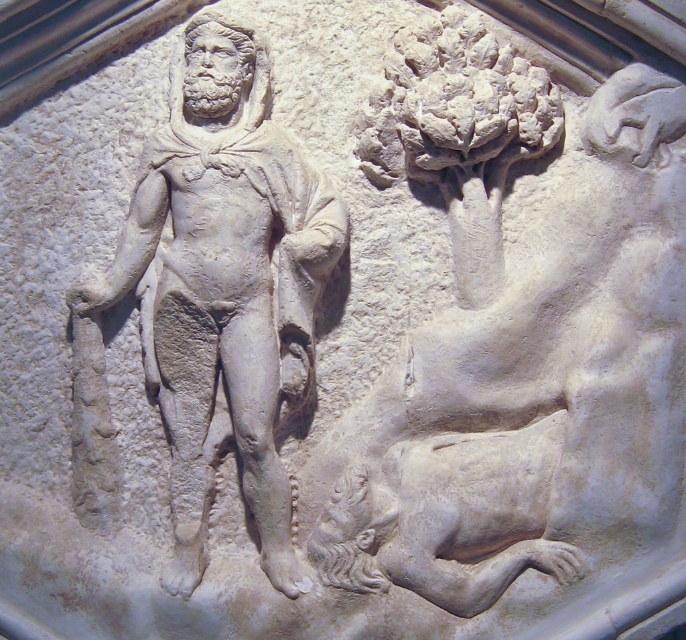
Question: Which of the following is the closest to the observer?

Choices:
 (A) click(x=99, y=467)
 (B) click(x=541, y=460)

Answer: (B)

Question: Which of the following is the farthest from the observer?

Choices:
 (A) (x=209, y=269)
 (B) (x=541, y=468)

Answer: (A)

Question: Does white stone tree at upper center have a lesser width compared to white stone god at center?

Choices:
 (A) no
 (B) yes

Answer: (A)

Question: Is the position of white stone tree at upper center less distant than that of white stone god at center?

Choices:
 (A) no
 (B) yes

Answer: (A)

Question: Is white stone tree at upper center to the right of white stone god at center from the viewer's perspective?

Choices:
 (A) yes
 (B) no

Answer: (A)